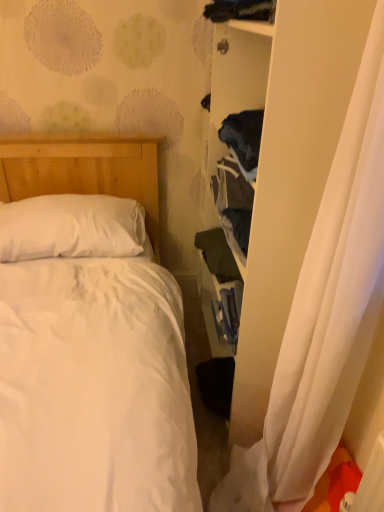
Question: Which direction should I rotate to look at dark blue fabric at upper center, acting as the second clothing starting from the back, — up or down?

Choices:
 (A) down
 (B) up

Answer: (B)

Question: From a real-world perspective, does dark blue fabric at upper center, which appears as the first clothing when viewed from the top, stand above dark green fabric at center-right, positioned as the 2th clothing in front-to-back order?

Choices:
 (A) yes
 (B) no

Answer: (A)

Question: Is dark blue fabric at upper center, the second clothing in the bottom-to-top sequence, not close to dark green fabric at center-right, placed as the 1th clothing when sorted from bottom to top?

Choices:
 (A) yes
 (B) no

Answer: (B)

Question: From the image's perspective, is dark blue fabric at upper center, which appears as the first clothing when viewed from the top, over dark green fabric at center-right, positioned as the 2th clothing in front-to-back order?

Choices:
 (A) yes
 (B) no

Answer: (A)

Question: Considering the relative sizes of dark blue fabric at upper center, which appears as the first clothing when viewed from the top, and dark green fabric at center-right, acting as the first clothing starting from the back, in the image provided, is dark blue fabric at upper center, which appears as the first clothing when viewed from the top, shorter than dark green fabric at center-right, acting as the first clothing starting from the back,?

Choices:
 (A) yes
 (B) no

Answer: (A)

Question: Is dark blue fabric at upper center, which appears as the first clothing when viewed from the top, at the right side of dark green fabric at center-right, placed as the 1th clothing when sorted from bottom to top?

Choices:
 (A) no
 (B) yes

Answer: (B)

Question: Does dark blue fabric at upper center, which appears as the first clothing when viewed from the top, have a greater width compared to dark green fabric at center-right, positioned as the 2th clothing in front-to-back order?

Choices:
 (A) yes
 (B) no

Answer: (A)

Question: From a real-world perspective, is white soft pillow at upper left on dark green fabric at center-right, the 2th clothing when ordered from top to bottom?

Choices:
 (A) no
 (B) yes

Answer: (B)

Question: Does white soft pillow at upper left have a greater width compared to dark green fabric at center-right, positioned as the 2th clothing in front-to-back order?

Choices:
 (A) no
 (B) yes

Answer: (B)

Question: Does white soft pillow at upper left have a greater height compared to dark green fabric at center-right, the 2th clothing when ordered from top to bottom?

Choices:
 (A) yes
 (B) no

Answer: (A)

Question: Is white soft pillow at upper left surrounding dark green fabric at center-right, the 2th clothing when ordered from top to bottom?

Choices:
 (A) no
 (B) yes

Answer: (A)

Question: Could you tell me if white soft pillow at upper left is turned towards dark green fabric at center-right, the 2th clothing when ordered from top to bottom?

Choices:
 (A) no
 (B) yes

Answer: (A)

Question: From the image's perspective, is white soft pillow at upper left below dark green fabric at center-right, positioned as the 2th clothing in front-to-back order?

Choices:
 (A) no
 (B) yes

Answer: (A)

Question: From the image's perspective, is dark green fabric at center-right, acting as the first clothing starting from the back, located beneath white sheer curtain at right?

Choices:
 (A) yes
 (B) no

Answer: (B)